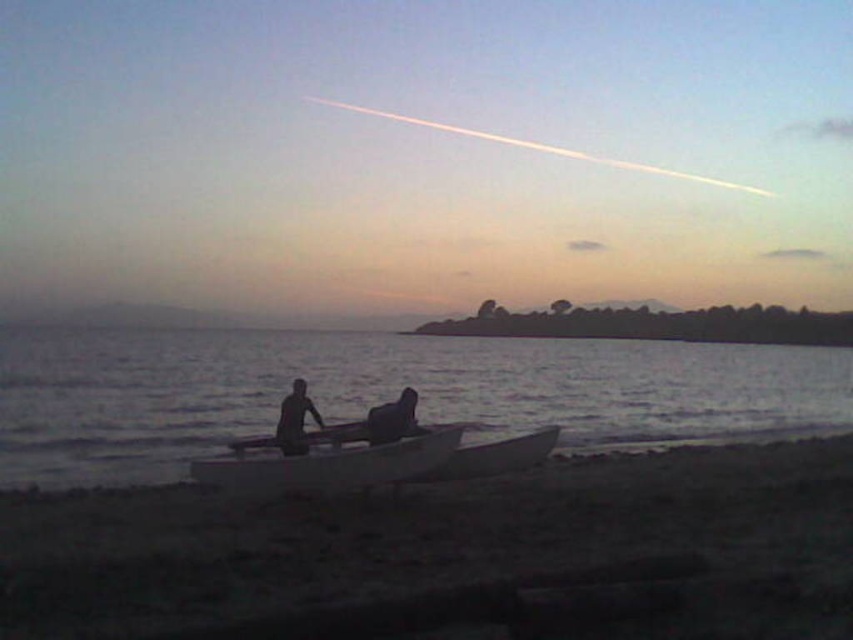
Question: Among these objects, which one is nearest to the camera?

Choices:
 (A) smooth water at boat right
 (B) silhouette skin couple at center
 (C) dark matte skin at center
 (D) smooth dark skin at center

Answer: (D)

Question: Which is farther from the silhouette skin couple at center?

Choices:
 (A) dark matte skin at center
 (B) smooth gray boat at center
 (C) smooth white canoe at center
 (D) smooth sand at lower center

Answer: (D)

Question: Is smooth white canoe at center bigger than dark matte skin at center?

Choices:
 (A) yes
 (B) no

Answer: (A)

Question: Does smooth water at boat right appear on the left side of smooth white canoe at center?

Choices:
 (A) no
 (B) yes

Answer: (B)

Question: Does silhouette skin couple at center have a larger size compared to smooth dark skin at center?

Choices:
 (A) yes
 (B) no

Answer: (A)

Question: Among these objects, which one is farthest from the camera?

Choices:
 (A) dark matte skin at center
 (B) smooth dark skin at center
 (C) smooth white canoe at center

Answer: (A)